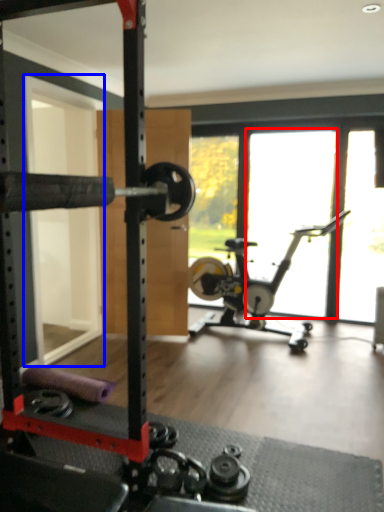
Question: Among these objects, which one is farthest to the camera, window (highlighted by a red box) or screen door (highlighted by a blue box)?

Choices:
 (A) window
 (B) screen door

Answer: (A)